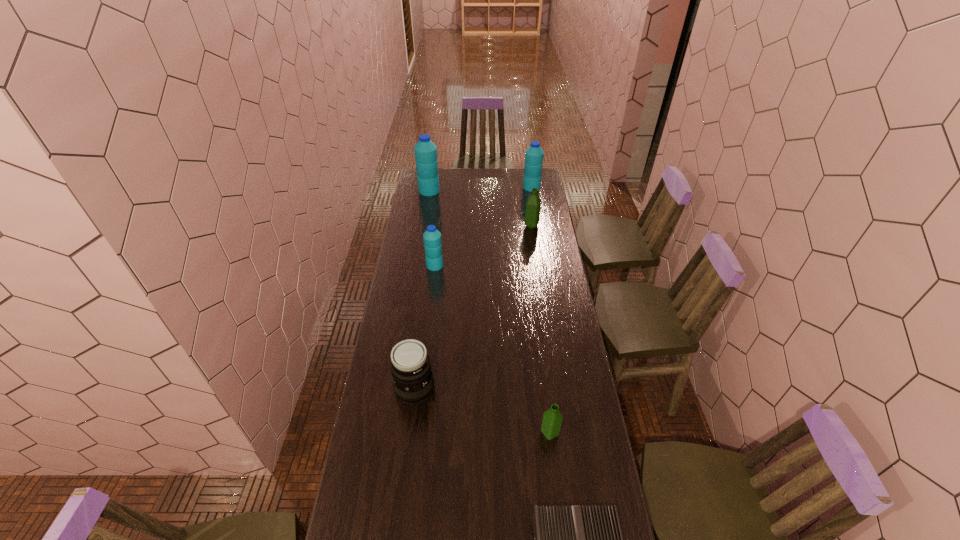
Select which blue water bottle is the third closest to the farther green water bottle. Please provide its 2D coordinates. Your answer should be formatted as a tuple, i.e. [(x, y)], where the tuple contains the x and y coordinates of a point satisfying the conditions above.

[(425, 150)]

Locate an element on the screen. the closest blue water bottle relative to the second tallest water bottle is located at coordinates (425, 150).

Find the location of a particular element. The height and width of the screenshot is (540, 960). vacant area in the image that satisfies the following two spatial constraints: 1. on the back side of the telephoto lens; 2. on the left side of the second tallest water bottle is located at coordinates (440, 187).

This screenshot has width=960, height=540. What are the coordinates of `vacant point that satisfies the following two spatial constraints: 1. on the back side of the telephoto lens; 2. on the right side of the fifth nearest object` in the screenshot? It's located at (435, 226).